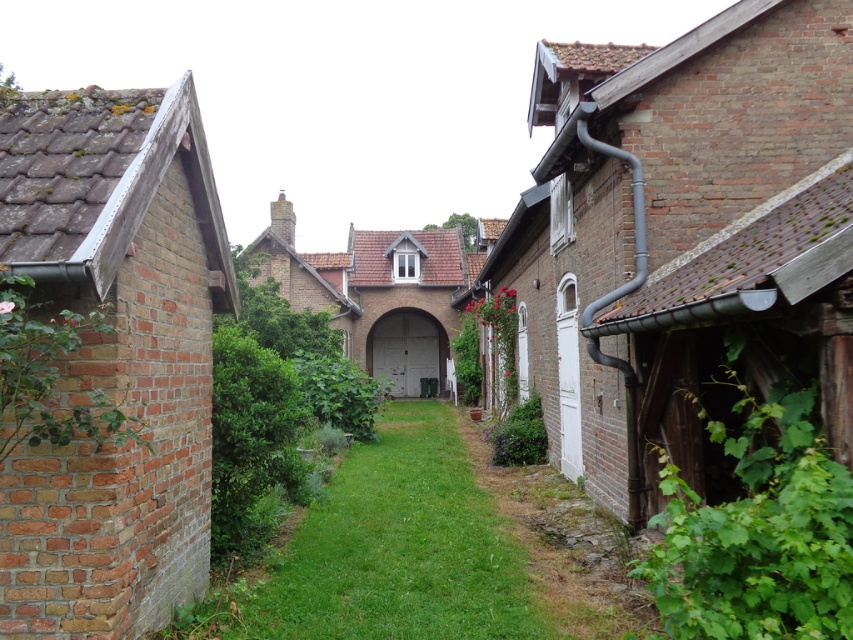
You are a gardener who needs to plant flowers along the green grass at center and the brown stone path at lower right. Which area has a wider space to accommodate more flowers?

The green grass at center has a wider space than the brown stone path at lower right, so it can accommodate more flowers.

You are standing at the entrance of the pathway and want to walk towards the brown stone path at lower right. Which direction should you head relative to the green grass at center?

You should head to the right of the green grass at center since the brown stone path at lower right is located to the right of it.

You are standing at the entrance of the pathway and want to walk towards the brown stone path at lower right. Which direction should you move relative to the green grass at center?

Since the green grass at center is closer to the viewer than the brown stone path at lower right, you should move away from the green grass at center to reach the brown stone path at lower right.